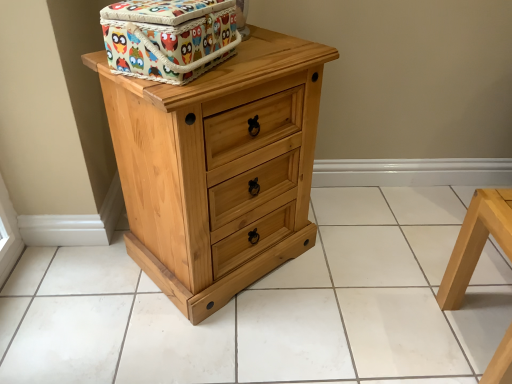
The image size is (512, 384). What are the coordinates of `vacant area to the right of natural wood chest of drawers at center` in the screenshot? It's located at (357, 264).